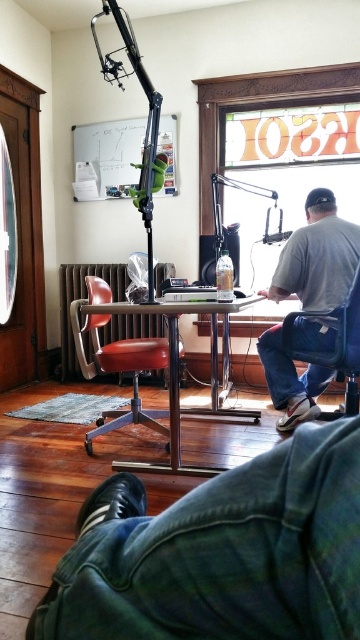
Question: Can you confirm if leather-like swivel chair at center is positioned to the right of matte blue chair at center?

Choices:
 (A) no
 (B) yes

Answer: (A)

Question: Can you confirm if denim pants at lower right is positioned to the left of metallic silver table at center?

Choices:
 (A) no
 (B) yes

Answer: (B)

Question: Which of the following is the farthest from the observer?

Choices:
 (A) denim pants at lower right
 (B) metallic silver table at center
 (C) matte blue chair at center

Answer: (C)

Question: Can you confirm if leather-like swivel chair at center is smaller than matte blue chair at center?

Choices:
 (A) no
 (B) yes

Answer: (A)

Question: Which point is closer to the camera taking this photo?

Choices:
 (A) (303, 518)
 (B) (69, 308)
 (C) (340, 330)
 (D) (124, 305)

Answer: (A)

Question: Which point is farther to the camera?

Choices:
 (A) leather-like swivel chair at center
 (B) denim pants at lower right

Answer: (A)